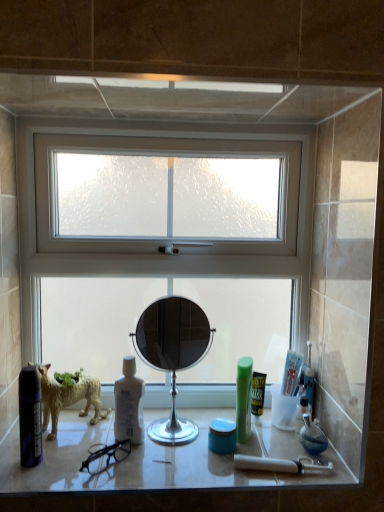
At what (x,y) coordinates should I click in order to perform the action: click on free space between matte black can at left and green plastic bottle at center-right. Please return your answer as a coordinate pair (x, y). The width and height of the screenshot is (384, 512). Looking at the image, I should click on (132, 453).